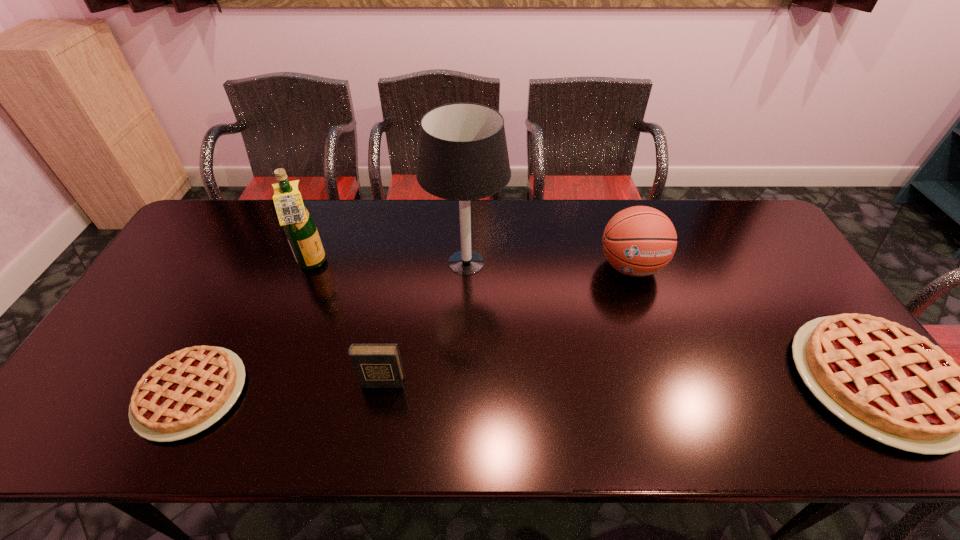
Locate an element on the screen. vacant space located 0.160m on the back of the leftmost object is located at coordinates (237, 302).

I want to click on vacant space located on the left of the table lamp, so click(x=388, y=262).

I want to click on free point located on the front-facing side of the fifth object from right to left, so click(x=399, y=264).

The height and width of the screenshot is (540, 960). Find the location of `free space located 0.170m on the logo side of the second object from right to left`. free space located 0.170m on the logo side of the second object from right to left is located at coordinates (655, 339).

Locate an element on the screen. This screenshot has height=540, width=960. table lamp that is at the far edge is located at coordinates (463, 156).

Where is `basketball at the far edge`? The width and height of the screenshot is (960, 540). basketball at the far edge is located at coordinates (638, 241).

Where is `pie located in the near edge section of the desktop`? pie located in the near edge section of the desktop is located at coordinates (186, 392).

Image resolution: width=960 pixels, height=540 pixels. I want to click on diary that is positioned at the near edge, so click(376, 365).

What are the coordinates of `object that is at the left edge` in the screenshot? It's located at (186, 392).

Locate an element on the screen. Image resolution: width=960 pixels, height=540 pixels. object at the near left corner is located at coordinates (186, 392).